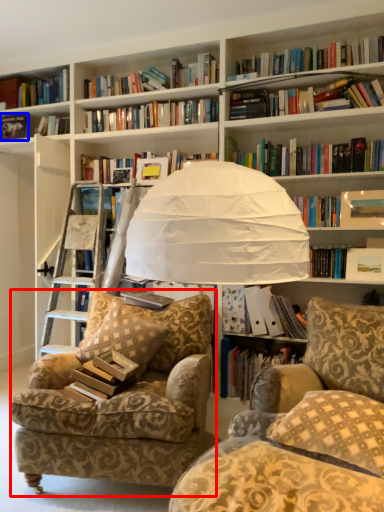
Question: Which point is closer to the camera, chair (highlighted by a red box) or book (highlighted by a blue box)?

Choices:
 (A) chair
 (B) book

Answer: (A)